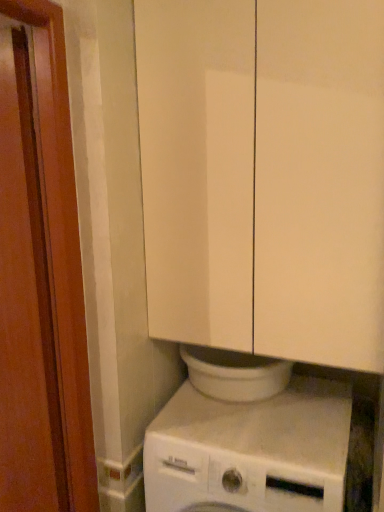
Question: In which direction should I rotate to look at white matte washing machine at lower center?

Choices:
 (A) right
 (B) left

Answer: (A)

Question: Is white glossy cabinet at upper center behind white matte washing machine at lower center?

Choices:
 (A) no
 (B) yes

Answer: (A)

Question: Does white glossy cabinet at upper center lie in front of white matte washing machine at lower center?

Choices:
 (A) yes
 (B) no

Answer: (A)

Question: Does white glossy cabinet at upper center have a larger size compared to white matte washing machine at lower center?

Choices:
 (A) no
 (B) yes

Answer: (B)

Question: From a real-world perspective, is white glossy cabinet at upper center under white matte washing machine at lower center?

Choices:
 (A) yes
 (B) no

Answer: (B)

Question: Is white matte washing machine at lower center surrounded by white glossy cabinet at upper center?

Choices:
 (A) no
 (B) yes

Answer: (A)

Question: Does white glossy cabinet at upper center have a smaller size compared to white matte washing machine at lower center?

Choices:
 (A) no
 (B) yes

Answer: (A)

Question: From a real-world perspective, is white matte washing machine at lower center over brown wood screen door at left?

Choices:
 (A) yes
 (B) no

Answer: (B)

Question: Does white matte washing machine at lower center lie in front of brown wood screen door at left?

Choices:
 (A) no
 (B) yes

Answer: (A)

Question: Are white matte washing machine at lower center and brown wood screen door at left far apart?

Choices:
 (A) yes
 (B) no

Answer: (B)

Question: Is white matte washing machine at lower center further to camera compared to brown wood screen door at left?

Choices:
 (A) yes
 (B) no

Answer: (A)

Question: Is white matte washing machine at lower center not within brown wood screen door at left?

Choices:
 (A) no
 (B) yes

Answer: (B)

Question: Is white matte washing machine at lower center thinner than brown wood screen door at left?

Choices:
 (A) no
 (B) yes

Answer: (A)

Question: Does brown wood screen door at left come behind white glossy cabinet at upper center?

Choices:
 (A) yes
 (B) no

Answer: (B)